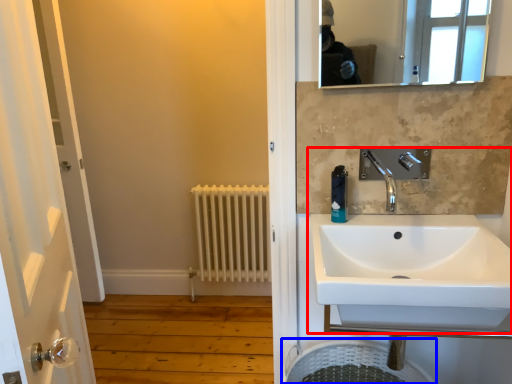
Question: Among these objects, which one is farthest to the camera, sink (highlighted by a red box) or laundry basket (highlighted by a blue box)?

Choices:
 (A) sink
 (B) laundry basket

Answer: (B)